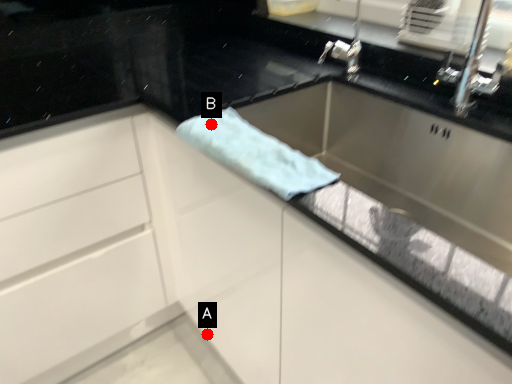
Question: Two points are circled on the image, labeled by A and B beside each circle. Which point is farther to the camera?

Choices:
 (A) A is further
 (B) B is further

Answer: (A)